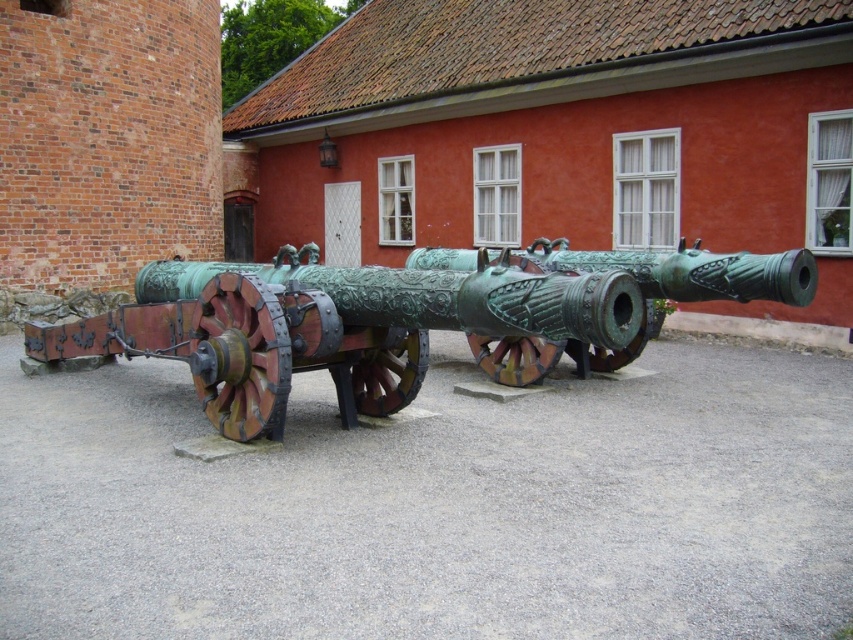
Is green patina metal cannon at center positioned before bronze/greenish metal cannon at center?

No, green patina metal cannon at center is behind bronze/greenish metal cannon at center.

Can you confirm if green patina metal cannon at center is positioned above bronze/greenish metal cannon at center?

Yes, green patina metal cannon at center is above bronze/greenish metal cannon at center.

Identify the location of green patina metal cannon at center. (403, 317).